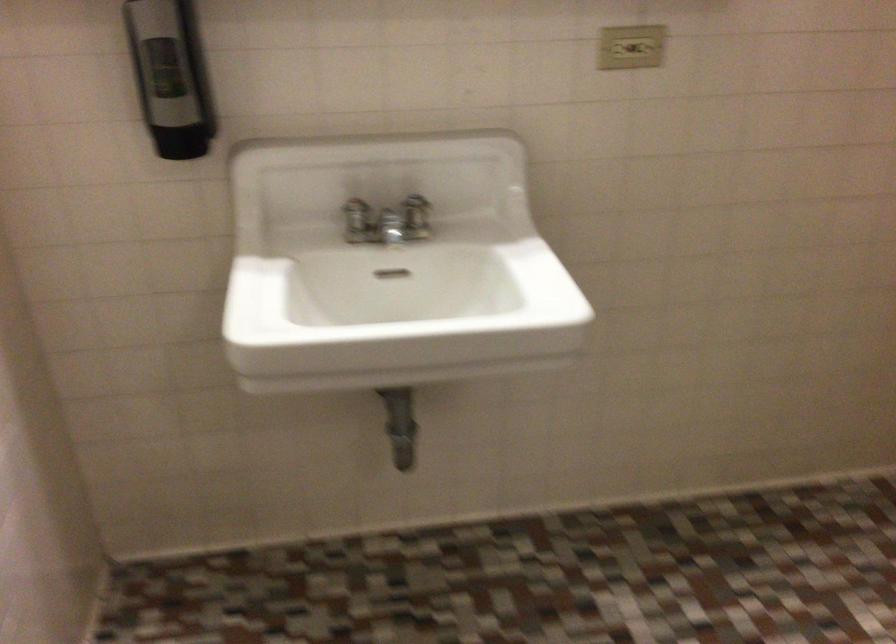
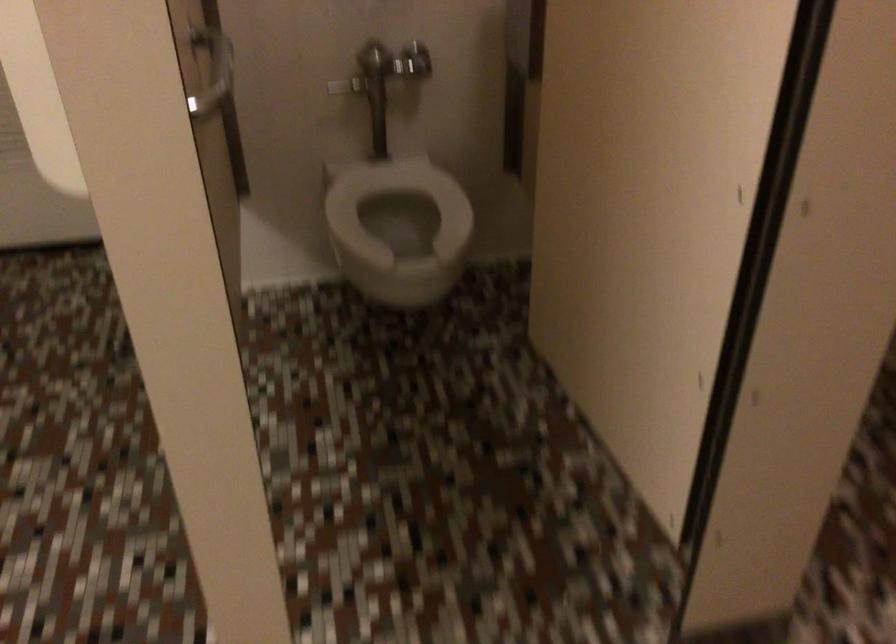
Looking at this image, how did the camera likely rotate?

The camera's rotation is toward right-down.